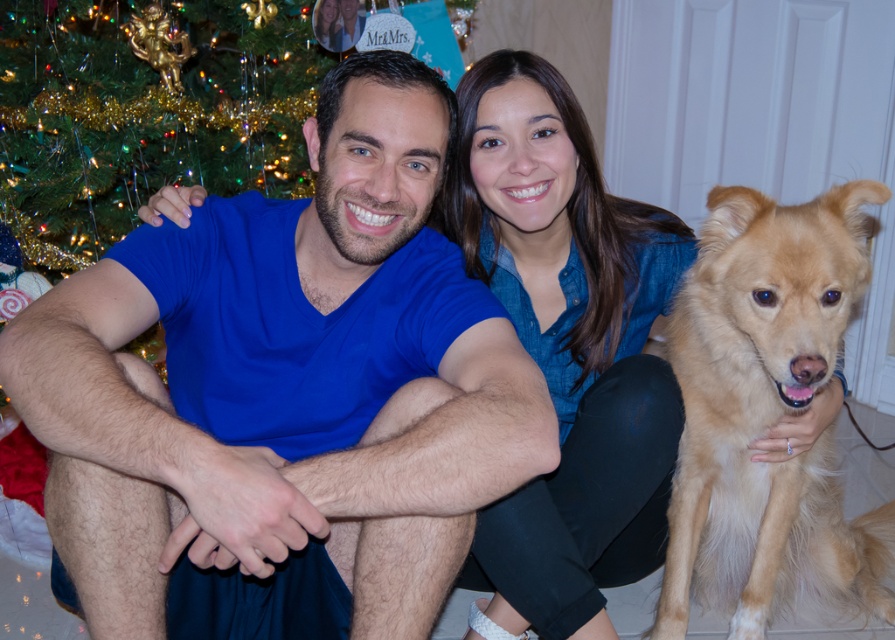
Question: Among these points, which one is nearest to the camera?

Choices:
 (A) (597, 486)
 (B) (526, 368)
 (C) (812, 262)

Answer: (B)

Question: Which of the following is the closest to the observer?

Choices:
 (A) golden fur dog at right
 (B) denim shirt at center
 (C) blue matte shirt at center

Answer: (C)

Question: Which object appears closest to the camera in this image?

Choices:
 (A) golden fur dog at right
 (B) blue matte shirt at center

Answer: (B)

Question: Does blue matte shirt at center have a greater width compared to golden fur dog at right?

Choices:
 (A) no
 (B) yes

Answer: (B)

Question: In this image, where is denim shirt at center located relative to golden fur dog at right?

Choices:
 (A) left
 (B) right

Answer: (A)

Question: Does blue matte shirt at center have a lesser width compared to denim shirt at center?

Choices:
 (A) no
 (B) yes

Answer: (A)